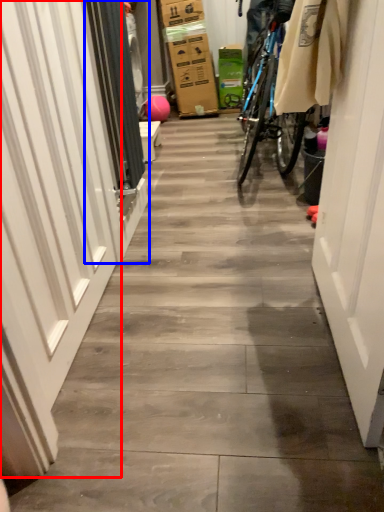
Question: Which object appears farthest to the camera in this image, garage door (highlighted by a red box) or screen door (highlighted by a blue box)?

Choices:
 (A) garage door
 (B) screen door

Answer: (B)